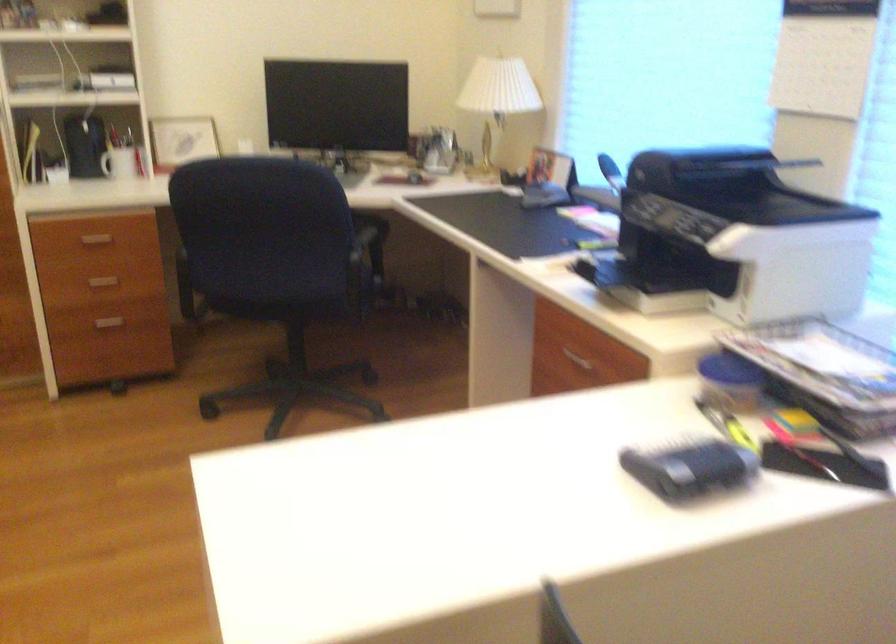
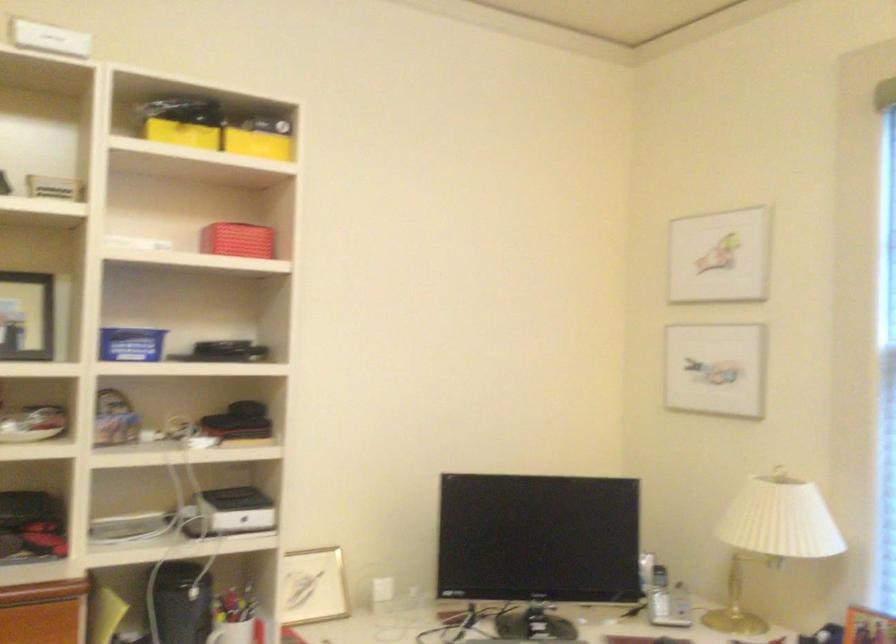
Find the pixel in the second image that matches point 108,152 in the first image.

(231, 632)